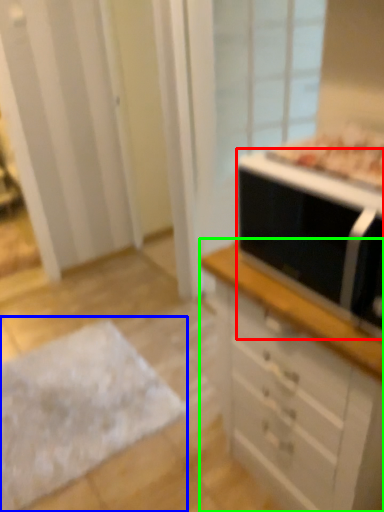
Question: Which is farther away from microwave oven (highlighted by a red box)? flat (highlighted by a blue box) or chest of drawers (highlighted by a green box)?

Choices:
 (A) flat
 (B) chest of drawers

Answer: (A)